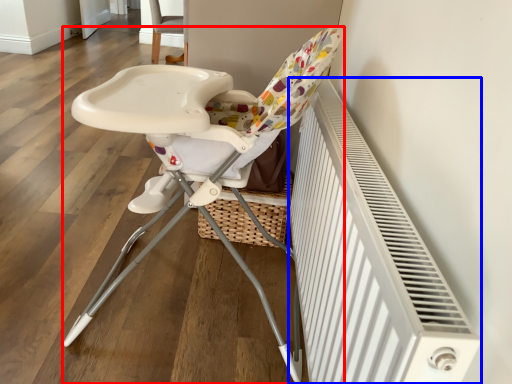
Question: Which point is further to the camera, chair (highlighted by a red box) or radiator (highlighted by a blue box)?

Choices:
 (A) chair
 (B) radiator

Answer: (A)